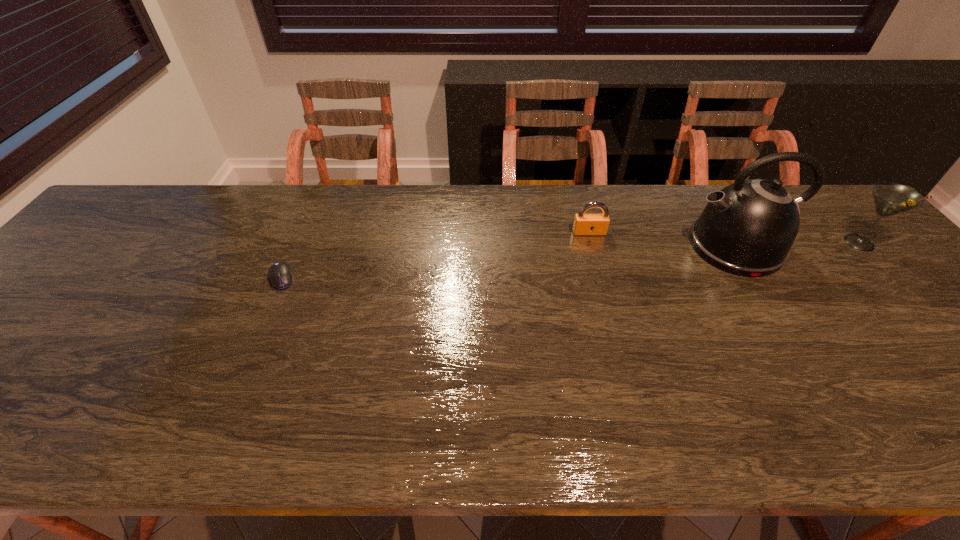
You are a GUI agent. You are given a task and a screenshot of the screen. Output one action in this format:
    pyautogui.click(x=<x>, y=<y>)
    Task: Click on the tallest object
    The height and width of the screenshot is (540, 960).
    Given the screenshot: What is the action you would take?
    point(747,229)

Locate an element on the screen. The width and height of the screenshot is (960, 540). the second object from right to left is located at coordinates (747, 229).

Find the location of a particular element. the rightmost object is located at coordinates (890, 198).

Locate an element on the screen. This screenshot has width=960, height=540. martini is located at coordinates (890, 198).

At what (x,y) coordinates should I click in order to perform the action: click on the second object from left to right. Please return your answer as a coordinate pair (x, y). Looking at the image, I should click on (584, 224).

The image size is (960, 540). In order to click on the second shortest object in this screenshot , I will do coord(584,224).

Identify the location of the shortest object. (280, 275).

In order to click on computer mouse in this screenshot , I will do `click(280, 275)`.

At what (x,y) coordinates should I click in order to perform the action: click on vacant position located on the spout of the third object from left to right. Please return your answer as a coordinate pair (x, y). Image resolution: width=960 pixels, height=540 pixels. Looking at the image, I should click on (617, 247).

Locate an element on the screen. The width and height of the screenshot is (960, 540). free space located 0.210m on the spout of the third object from left to right is located at coordinates pos(611,247).